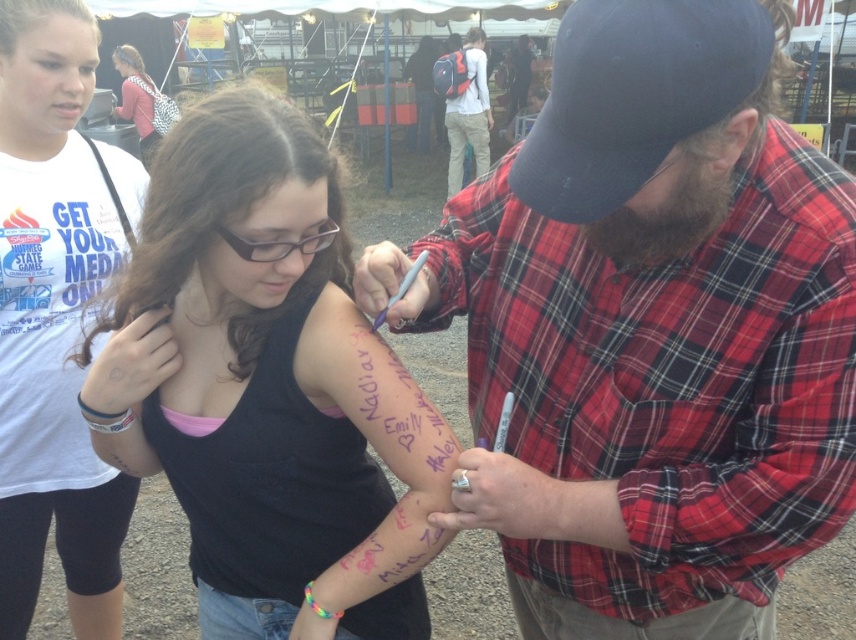
You are standing at the position of the red plaid shirt at center and want to throw a ball to the red plaid shirt at upper center. Can you reach them in one throw if your maximum throwing distance is 8 meters?

The distance between the red plaid shirt at center and the red plaid shirt at upper center is 8.24 meters, which exceeds your maximum throwing distance of 8 meters. Therefore, you cannot reach them in one throw.

You are a photographer at the fair. You need to take a photo that includes both the red plaid shirt at upper center and the matte pink shirt at upper left. Based on their heights, which shirt should be placed in the foreground to ensure both are fully visible in the frame?

The red plaid shirt at upper center has a greater height compared to the matte pink shirt at upper left. To ensure both are fully visible, the taller red plaid shirt at upper center should be placed in the foreground so that the shorter matte pink shirt at upper left can be seen behind it without being obscured.